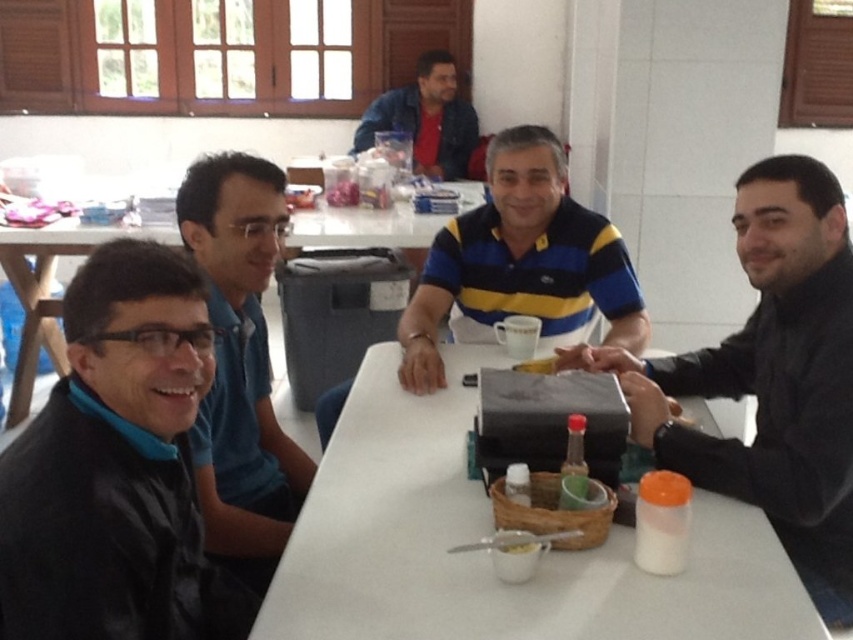
Question: Can you confirm if black matte jacket at lower left is positioned to the left of denim jacket at upper center?

Choices:
 (A) yes
 (B) no

Answer: (A)

Question: Based on their relative distances, which object is farther from the yellow striped polo shirt at center?

Choices:
 (A) blue shirt at left
 (B) black matte shirt at right

Answer: (A)

Question: Which point appears farthest from the camera in this image?

Choices:
 (A) (405, 112)
 (B) (131, 364)
 (C) (778, 198)

Answer: (A)

Question: Which object is the farthest from the yellow striped polo shirt at center?

Choices:
 (A) white matte table at center
 (B) black matte jacket at lower left

Answer: (B)

Question: Considering the relative positions of white matte table at center and black matte shirt at right in the image provided, where is white matte table at center located with respect to black matte shirt at right?

Choices:
 (A) right
 (B) left

Answer: (B)

Question: In this image, where is black matte shirt at right located relative to blue shirt at left?

Choices:
 (A) above
 (B) below

Answer: (B)